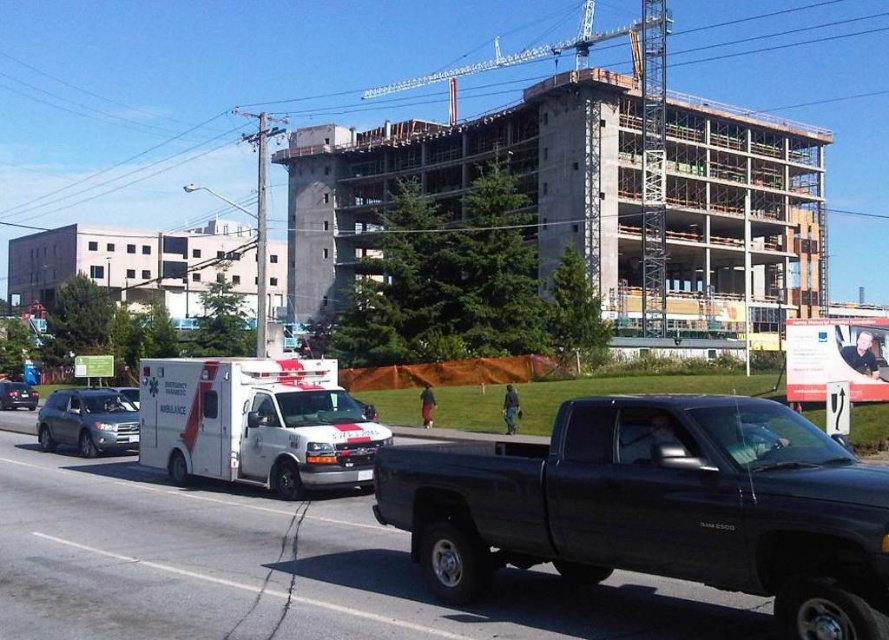
You are standing in front of the construction site and notice two points marked on the image. Which point, point [758,406] or point [322,417], is closer to you?

Point [758,406] is closer to the viewer than point [322,417].

You are a delivery driver who needs to park your vehicle in a low clearance garage. The garage has a height limit of 5 feet. You see a matte gray suv at left and a metallic silver car at left in the scene. Which vehicle would you choose to park in the garage?

The metallic silver car at left has a lower height compared to the matte gray suv at left, so you should choose the metallic silver car at left to park in the garage since it meets the height requirement.

You are a delivery driver approaching the construction site. You see a matte black pickup truck at center and a white glossy ambulance at center. How far apart are the two vehicles?

The distance between the matte black pickup truck at center and the white glossy ambulance at center is 26.37 feet.